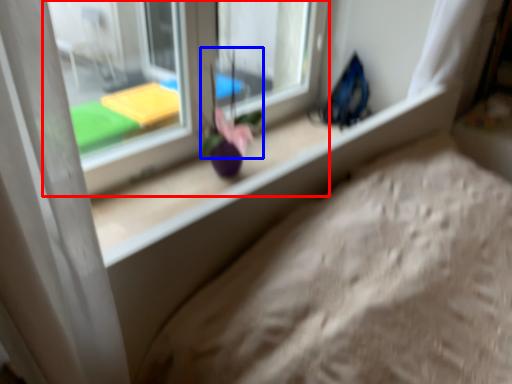
Question: Which of the following is the closest to the observer, window (highlighted by a red box) or flower (highlighted by a blue box)?

Choices:
 (A) window
 (B) flower

Answer: (A)